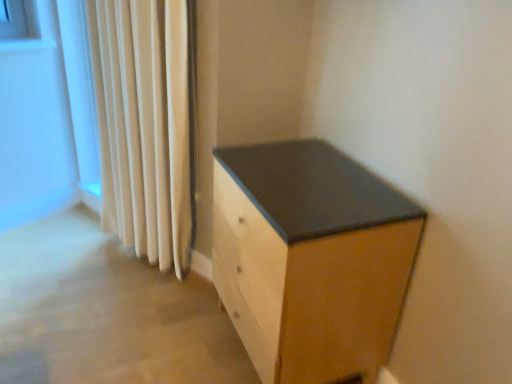
Locate an element on the screen. free location above matte black drawer at center (from a real-world perspective) is located at coordinates (305, 175).